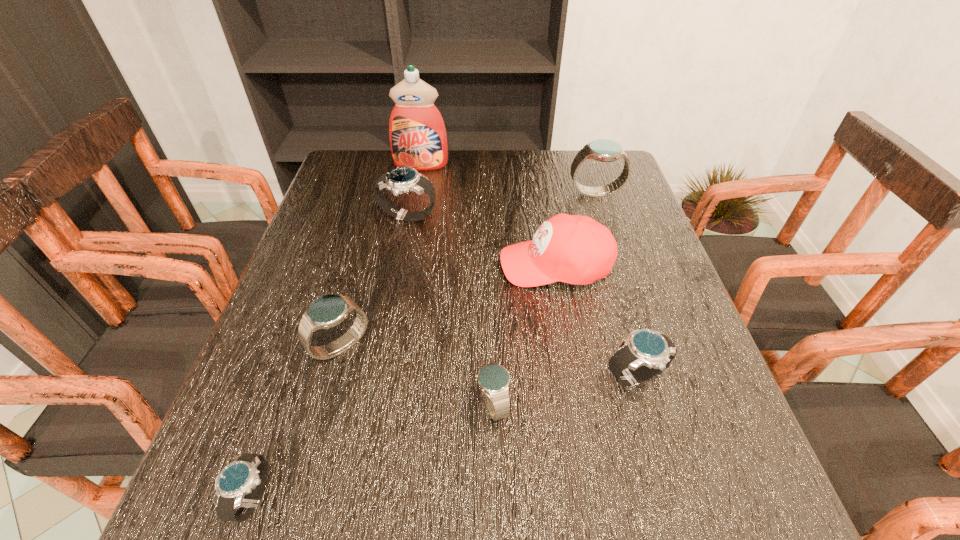
Find the location of a particular element. This screenshot has width=960, height=540. object that is at the far right corner is located at coordinates (603, 150).

This screenshot has width=960, height=540. In order to click on free space at the far edge of the desktop in this screenshot , I will do (449, 157).

The image size is (960, 540). I want to click on free spot at the near edge of the desktop, so pos(335,489).

Locate an element on the screen. This screenshot has width=960, height=540. blank area at the left edge is located at coordinates (315, 250).

I want to click on vacant region at the right edge of the desktop, so click(674, 402).

Image resolution: width=960 pixels, height=540 pixels. I want to click on vacant space at the far left corner of the desktop, so 385,168.

Where is `unoccupied position between the smallest silver watch and the tallest object`? unoccupied position between the smallest silver watch and the tallest object is located at coordinates (338, 331).

Find the location of a particular element. This screenshot has height=540, width=960. free space between the farthest silver watch and the rightmost silver watch is located at coordinates (521, 298).

You are a GUI agent. You are given a task and a screenshot of the screen. Output one action in this format:
    pyautogui.click(x=<x>, y=<y>)
    Task: Click on the vacant point located between the second farthest blue watch and the red detergent
    The width and height of the screenshot is (960, 540).
    Given the screenshot: What is the action you would take?
    pyautogui.click(x=381, y=256)

You are a GUI agent. You are given a task and a screenshot of the screen. Output one action in this format:
    pyautogui.click(x=<x>, y=<y>)
    Task: Click on the vacant space that's between the fourth farthest object and the detergent
    This screenshot has height=540, width=960.
    Given the screenshot: What is the action you would take?
    pyautogui.click(x=488, y=215)